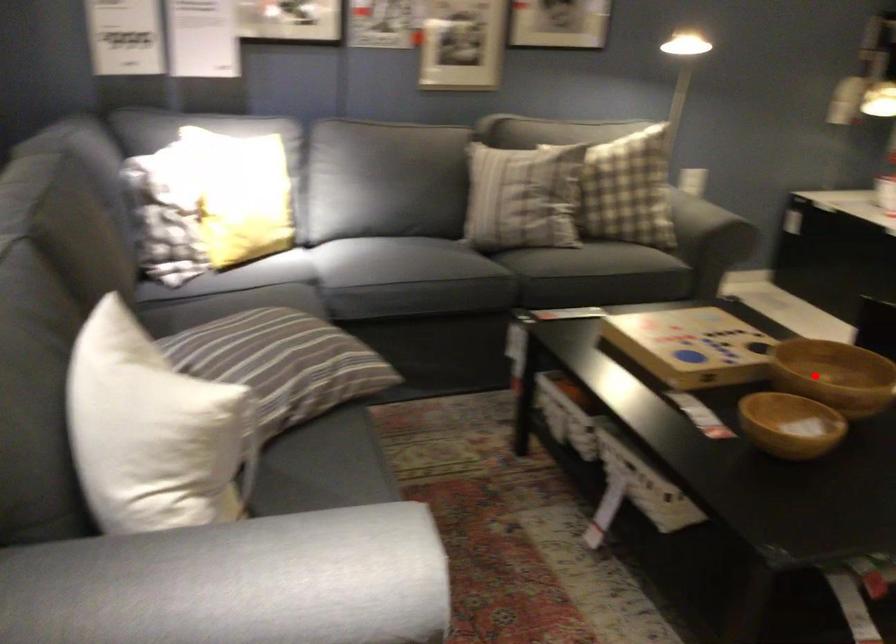
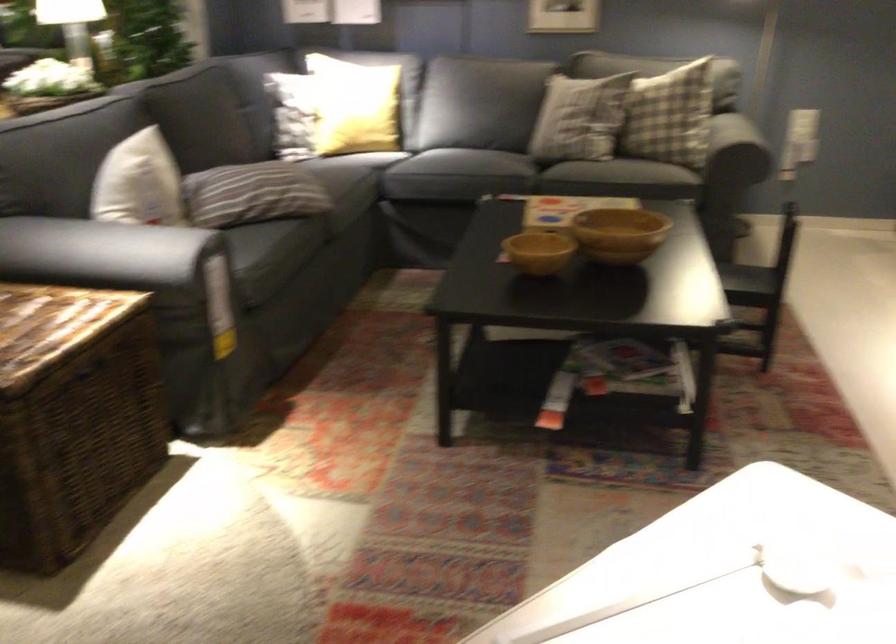
Question: I am providing you with two images of the same scene from different viewpoints. Given a red point in image1, look at the same physical point in image2. Is it:

Choices:
 (A) Closer to the viewpoint
 (B) Farther from the viewpoint

Answer: (B)